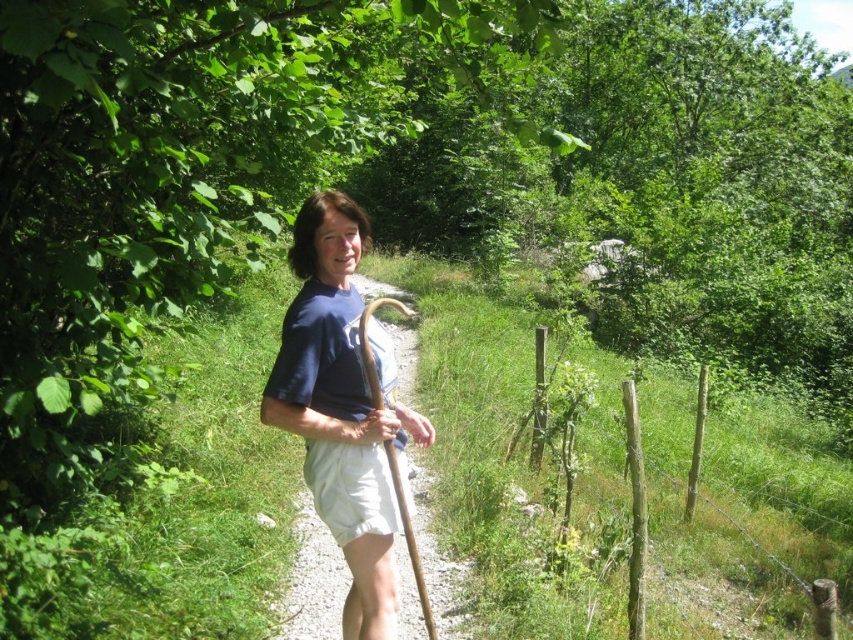
The person is wearing a blue cotton shirt at center and white cotton shorts at center. Which clothing item has a greater width?

The blue cotton shirt at center has a greater width than the white cotton shorts at center.

You are a photographer trying to capture the person in the image. Since you want to focus on their clothing, you need to know which part of their outfit is closer to the camera. Which item is nearer to the camera between the blue cotton shirt at center and the white cotton shorts at center?

The blue cotton shirt at center is closer to the viewer than the white cotton shorts at center, so it will appear nearer to the camera.

You are standing at the point with coordinates point (701, 385) and want to walk to point (398, 512). Given that the path is narrow and surrounded by dense vegetation, will you have to walk forward or backward to reach your destination?

You will have to walk forward to reach point (398, 512) from point (701, 385) because point (398, 512) is closer to the viewer, so moving forward towards it would be the correct direction.